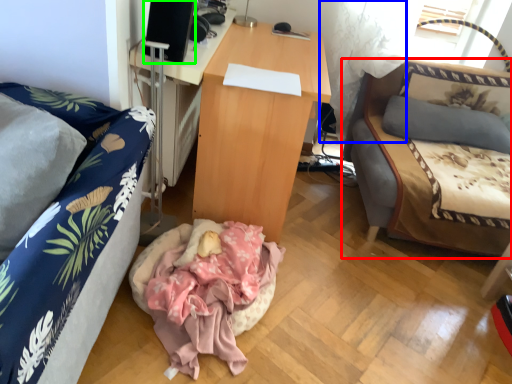
Question: Considering the real-world distances, which object is farthest from studio couch (highlighted by a red box)? curtain (highlighted by a blue box) or speaker (highlighted by a green box)?

Choices:
 (A) curtain
 (B) speaker

Answer: (B)